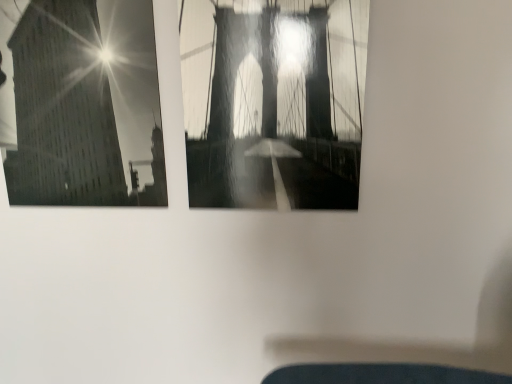
Question: In terms of width, does smooth glass building at upper left, the 1th window in the left-to-right sequence, look wider or thinner when compared to metallic bridge at center, marked as the 1th window in a right-to-left arrangement?

Choices:
 (A) thin
 (B) wide

Answer: (A)

Question: In the image, is smooth glass building at upper left, the 1th window in the left-to-right sequence, positioned in front of or behind metallic bridge at center, the second window in the left-to-right sequence?

Choices:
 (A) front
 (B) behind

Answer: (B)

Question: In terms of height, does smooth glass building at upper left, the 1th window in the left-to-right sequence, look taller or shorter compared to metallic bridge at center, the second window in the left-to-right sequence?

Choices:
 (A) tall
 (B) short

Answer: (A)

Question: Is metallic bridge at center, marked as the 1th window in a right-to-left arrangement, to the left or to the right of smooth glass building at upper left, the 1th window in the left-to-right sequence, in the image?

Choices:
 (A) left
 (B) right

Answer: (B)

Question: In terms of width, does metallic bridge at center, the second window in the left-to-right sequence, look wider or thinner when compared to smooth glass building at upper left, the 1th window in the left-to-right sequence?

Choices:
 (A) thin
 (B) wide

Answer: (B)

Question: In terms of size, does metallic bridge at center, marked as the 1th window in a right-to-left arrangement, appear bigger or smaller than smooth glass building at upper left, the 1th window in the left-to-right sequence?

Choices:
 (A) big
 (B) small

Answer: (B)

Question: From a real-world perspective, is metallic bridge at center, the second window in the left-to-right sequence, positioned above or below smooth glass building at upper left, the 1th window in the left-to-right sequence?

Choices:
 (A) above
 (B) below

Answer: (B)